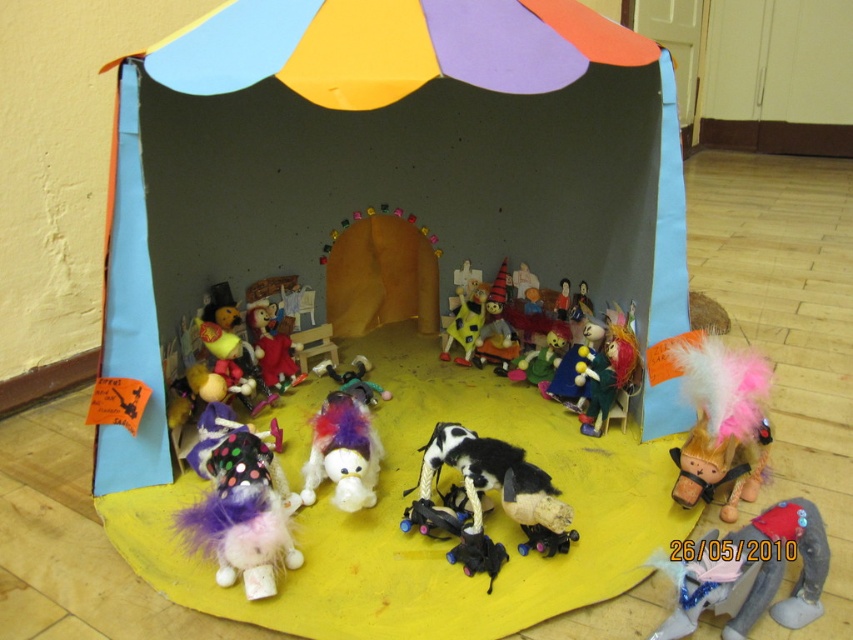
Looking at this image, you are setting up a miniature circus display and want to place the multicolored fabric doll at center inside the cardboard tent at center. Based on their sizes, will the doll fit comfortably inside the tent?

The cardboard tent at center is wider than the multicolored fabric doll at center, so the doll will fit comfortably inside the tent.

You are standing at the entrance of the cardboard tent and want to place a small decoration at the point marked as point (749,573). Which object in the scene is located at that point?

The point (749,573) is on the velvet pink plush at lower right.